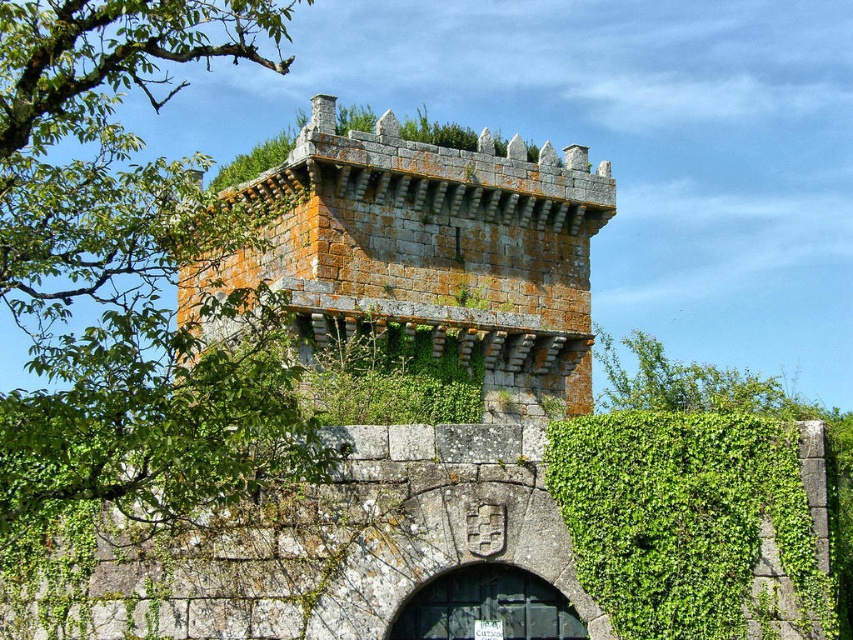
You are standing in front of the historic stone tower and want to take a photo. You notice two points marked on the tower wall. The first point is at coordinate point [24,492] and the second is at point [675,477]. Which point will appear larger in your photo?

Point [24,492] is closer to the camera than point [675,477]. Since objects closer to the camera appear larger in a photo, the point at [24,492] will appear larger in the photo.

You are standing at the coordinates 0.5, 0.5 in the image. Can you see the gray stone tower at center from your current position?

Yes, the gray stone tower at center is located at point [432,252], which is very close to your current position at [426,320]. Therefore, you can see it from where you are standing.